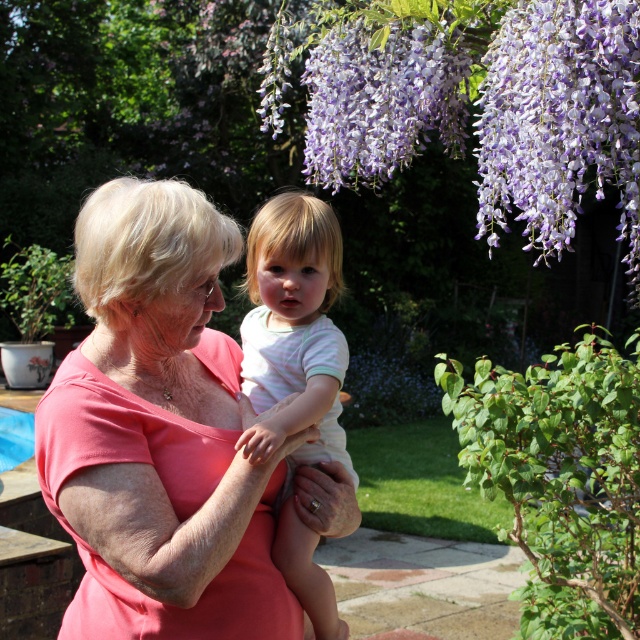
In the garden scene, there is a white striped shirt at center and purple matte flowers at upper center. From the perspective of an observer looking at the image, which object is positioned to the left?

The white striped shirt at center is positioned to the left of the purple matte flowers at upper center.

You are standing in the garden and want to place a small statue between the two points, point (112, 618) and point (320, 166). Which point should the statue be closer to if you want it to be more visible to visitors entering from the front?

The statue should be placed closer to point (112, 618) because it is closer to the viewer, making it more visible to visitors entering from the front.